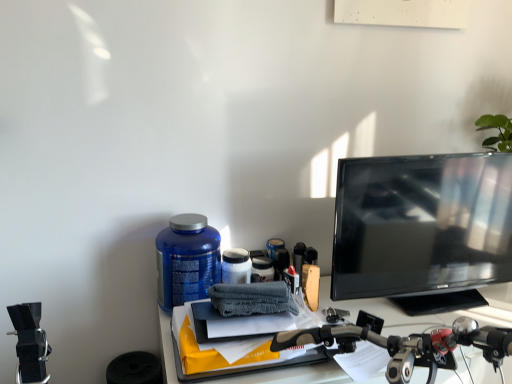
Question: Choose the correct answer: Is black glossy monitor at right inside matte blue container at center or outside it?

Choices:
 (A) outside
 (B) inside

Answer: (A)

Question: From a real-world perspective, is black glossy monitor at right physically located above or below matte blue container at center?

Choices:
 (A) below
 (B) above

Answer: (B)

Question: Considering the positions of black glossy monitor at right and matte blue container at center in the image, is black glossy monitor at right wider or thinner than matte blue container at center?

Choices:
 (A) thin
 (B) wide

Answer: (A)

Question: From the image's perspective, is matte blue container at center above or below black glossy monitor at right?

Choices:
 (A) below
 (B) above

Answer: (A)

Question: Based on their sizes in the image, would you say matte blue container at center is bigger or smaller than black glossy monitor at right?

Choices:
 (A) big
 (B) small

Answer: (B)

Question: Is matte blue container at center inside the boundaries of black glossy monitor at right, or outside?

Choices:
 (A) outside
 (B) inside

Answer: (A)

Question: From a real-world perspective, is matte blue container at center physically located above or below black glossy monitor at right?

Choices:
 (A) below
 (B) above

Answer: (A)